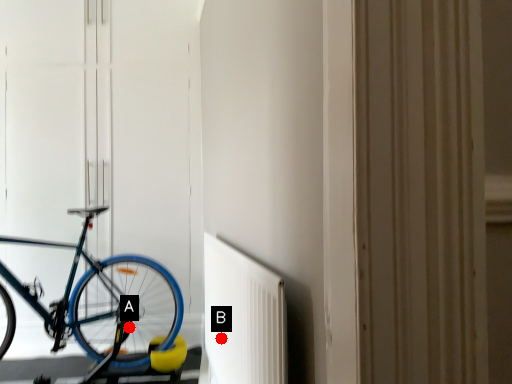
Question: Two points are circled on the image, labeled by A and B beside each circle. Which of the following is the farthest from the observer?

Choices:
 (A) A is further
 (B) B is further

Answer: (A)